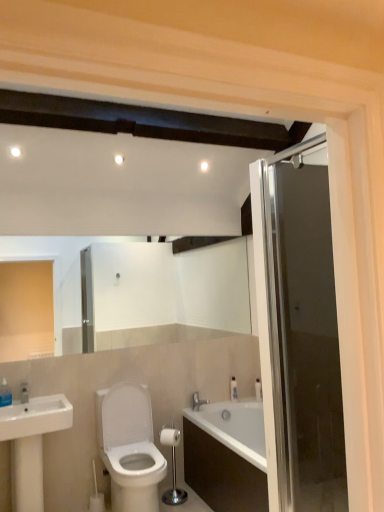
In order to click on transparent glass door at right in this screenshot , I will do `click(298, 330)`.

What is the approximate height of silver metallic faucet at lower center?

silver metallic faucet at lower center is 5.61 inches in height.

Locate an element on the screen. Image resolution: width=384 pixels, height=512 pixels. silver metallic faucet at lower center is located at coordinates (198, 401).

The width and height of the screenshot is (384, 512). What do you see at coordinates (258, 389) in the screenshot?
I see `white plastic bottle at right` at bounding box center [258, 389].

What is the approximate width of white plastic bottle at right?

It is 2.30 inches.

Where is `white glossy sink at left`? Image resolution: width=384 pixels, height=512 pixels. white glossy sink at left is located at coordinates (31, 444).

What do you see at coordinates (129, 447) in the screenshot? The height and width of the screenshot is (512, 384). I see `white glossy toilet at center` at bounding box center [129, 447].

This screenshot has width=384, height=512. I want to click on silver metallic toilet paper holder at center, so click(x=172, y=466).

Is silver metallic faucet at lower center facing away from white plastic bottle at right?

No, silver metallic faucet at lower center is not facing the opposite direction of white plastic bottle at right.

From the picture: From a real-world perspective, which object stands above the other?

white plastic bottle at right is physically above.

Are silver metallic faucet at lower center and white plastic bottle at right beside each other?

silver metallic faucet at lower center and white plastic bottle at right are not in contact.

Is silver metallic faucet at lower center positioned beyond the bounds of white plastic bottle at right?

Yes, silver metallic faucet at lower center is not within white plastic bottle at right.

From a real-world perspective, who is located higher, white matte toilet paper at center or silver metallic toilet paper holder at center?

white matte toilet paper at center, from a real-world perspective.

Is white matte toilet paper at center behind silver metallic toilet paper holder at center?

Yes.

Considering the positions of objects white matte toilet paper at center and silver metallic toilet paper holder at center in the image provided, who is more to the right, white matte toilet paper at center or silver metallic toilet paper holder at center?

Positioned to the right is silver metallic toilet paper holder at center.

Is white plastic bottle at right aimed at white glossy toilet at center?

Yes, white plastic bottle at right is facing white glossy toilet at center.

Considering the relative sizes of white plastic bottle at right and white glossy toilet at center in the image provided, is white plastic bottle at right shorter than white glossy toilet at center?

Yes.

From the image's perspective, relative to white glossy toilet at center, is white plastic bottle at right above or below?

white plastic bottle at right is above white glossy toilet at center.

From the picture: Considering the sizes of objects white plastic bottle at right and white glossy toilet at center in the image provided, who is thinner, white plastic bottle at right or white glossy toilet at center?

Thinner between the two is white plastic bottle at right.

Looking at this image, between white glossy toilet at center and transparent glass door at right, which one has larger size?

white glossy toilet at center.

From the picture: From a real-world perspective, is white glossy toilet at center positioned above or below transparent glass door at right?

white glossy toilet at center is below transparent glass door at right.

Find the location of a particular element. This screenshot has height=512, width=384. door that is on the right side of white glossy toilet at center is located at coordinates (298, 330).

Does point (112, 413) come in front of point (306, 346)?

That is False.

Would you say white glossy sink at left is part of silver metallic faucet at lower center's contents?

That's incorrect, white glossy sink at left is not inside silver metallic faucet at lower center.

Locate an element on the screen. This screenshot has height=512, width=384. sink on the left of silver metallic faucet at lower center is located at coordinates (31, 444).

Which of these two, silver metallic faucet at lower center or white glossy sink at left, stands taller?

With more height is white glossy sink at left.

Is silver metallic faucet at lower center in front of or behind white glossy sink at left in the image?

Clearly, silver metallic faucet at lower center is behind white glossy sink at left.

Can you confirm if white matte toilet paper at center is positioned to the left of silver metallic faucet at lower center?

Correct, you'll find white matte toilet paper at center to the left of silver metallic faucet at lower center.

Do you think white matte toilet paper at center is within silver metallic faucet at lower center, or outside of it?

white matte toilet paper at center exists outside the volume of silver metallic faucet at lower center.

Is white matte toilet paper at center wider than silver metallic faucet at lower center?

No.

The height and width of the screenshot is (512, 384). In order to click on toilet paper behind the white glossy sink at left in this screenshot , I will do coord(170,437).

Which is behind, white matte toilet paper at center or white glossy sink at left?

white matte toilet paper at center is further from the camera.

Measure the distance from white matte toilet paper at center to white glossy sink at left.

A distance of 92.91 centimeters exists between white matte toilet paper at center and white glossy sink at left.

Locate an element on the screen. tap below the white plastic bottle at right (from the image's perspective) is located at coordinates (198, 401).

Where is `towel bar in front of the white matte toilet paper at center`? towel bar in front of the white matte toilet paper at center is located at coordinates (172, 466).

From the image, which object appears to be nearer to transparent glass door at right, silver metallic faucet at lower center or silver metallic toilet paper holder at center?

silver metallic toilet paper holder at center is closer to transparent glass door at right.

From the image, which object appears to be farther from white glossy toilet at center, silver metallic faucet at lower center or white matte toilet paper at center?

silver metallic faucet at lower center.

Looking at the image, which one is located closer to transparent glass door at right, white plastic bottle at right or silver metallic faucet at lower center?

white plastic bottle at right is closer to transparent glass door at right.

Looking at the image, which one is located further to white matte toilet paper at center, silver metallic toilet paper holder at center or white glossy toilet at center?

white glossy toilet at center lies further to white matte toilet paper at center than the other object.

When comparing their distances from white plastic bottle at right, does transparent glass door at right or white glossy sink at left seem closer?

Based on the image, transparent glass door at right appears to be nearer to white plastic bottle at right.

Which object lies nearer to the anchor point white glossy sink at left, white plastic bottle at right or white matte toilet paper at center?

white matte toilet paper at center is closer to white glossy sink at left.

From the image, which object appears to be farther from transparent glass door at right, white glossy sink at left or white matte toilet paper at center?

Based on the image, white matte toilet paper at center appears to be further to transparent glass door at right.

Which object lies further to the anchor point white glossy sink at left, silver metallic toilet paper holder at center or silver metallic faucet at lower center?

silver metallic faucet at lower center is positioned further to the anchor white glossy sink at left.

I want to click on towel bar between white glossy toilet at center and white plastic bottle at right from front to back, so click(x=172, y=466).

Find the location of a particular element. towel bar between white glossy toilet at center and white matte toilet paper at center along the z-axis is located at coordinates pos(172,466).

Where is `towel bar between transparent glass door at right and white plastic bottle at right from front to back`? The image size is (384, 512). towel bar between transparent glass door at right and white plastic bottle at right from front to back is located at coordinates (172, 466).

At what (x,y) coordinates should I click in order to perform the action: click on tap situated between white matte toilet paper at center and white plastic bottle at right from left to right. Please return your answer as a coordinate pair (x, y). This screenshot has height=512, width=384. Looking at the image, I should click on click(x=198, y=401).